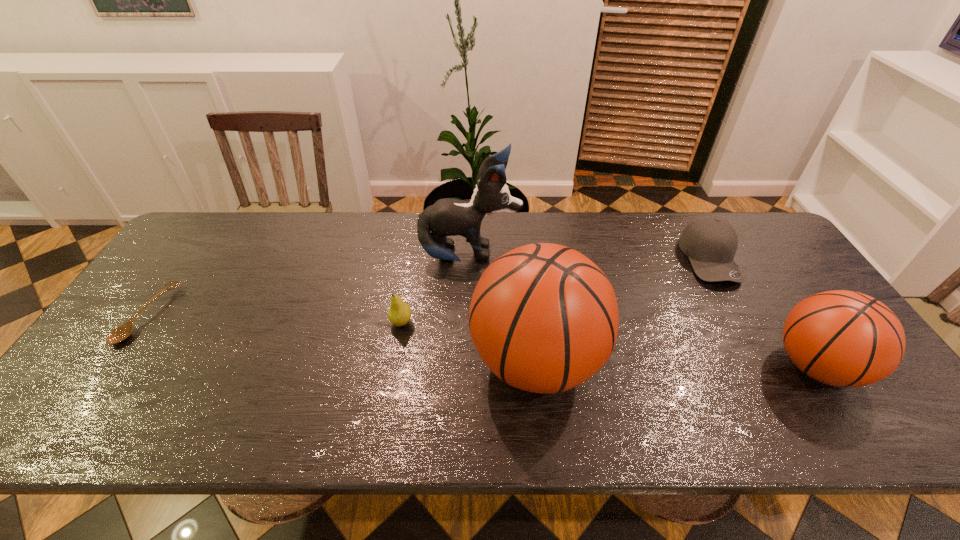
Locate an element on the screen. object that is at the near right corner is located at coordinates (842, 338).

This screenshot has height=540, width=960. What are the coordinates of `vacant space at the far edge of the desktop` in the screenshot? It's located at (540, 217).

What are the coordinates of `vacant space at the near edge` in the screenshot? It's located at (167, 379).

In the image, there is a desktop. At what (x,y) coordinates should I click in order to perform the action: click on free space at the right edge. Please return your answer as a coordinate pair (x, y). The image size is (960, 540). Looking at the image, I should click on (791, 302).

Find the location of `vacant space at the far left corner of the desktop`. vacant space at the far left corner of the desktop is located at coordinates point(203,235).

Where is `free space at the near left corner`? The image size is (960, 540). free space at the near left corner is located at coordinates (91, 396).

The width and height of the screenshot is (960, 540). In order to click on vacant space at the far right corner in this screenshot , I will do `click(740, 224)`.

The height and width of the screenshot is (540, 960). I want to click on free space that is in between the shortest object and the pear, so click(275, 319).

Find the location of `empty space between the third tallest object and the taller basketball`. empty space between the third tallest object and the taller basketball is located at coordinates (676, 364).

Locate an element on the screen. Image resolution: width=960 pixels, height=540 pixels. free point between the shortest object and the pear is located at coordinates (275, 319).